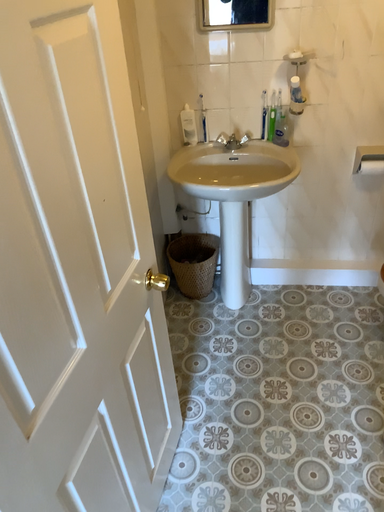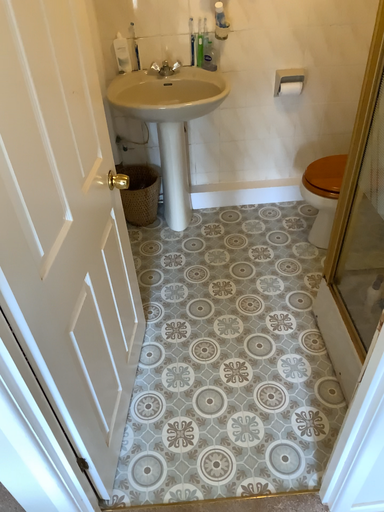
Question: Which way did the camera rotate in the video?

Choices:
 (A) rotated left
 (B) rotated right

Answer: (B)